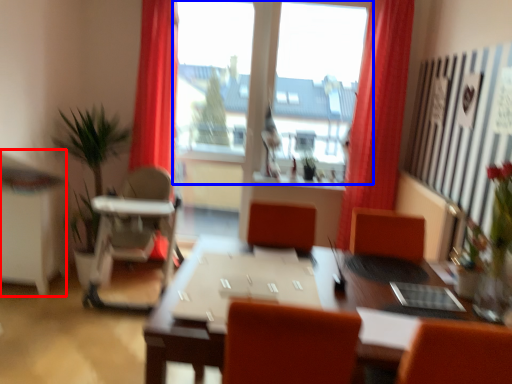
Question: Among these objects, which one is nearest to the camera, computer desk (highlighted by a red box) or window (highlighted by a blue box)?

Choices:
 (A) computer desk
 (B) window

Answer: (A)